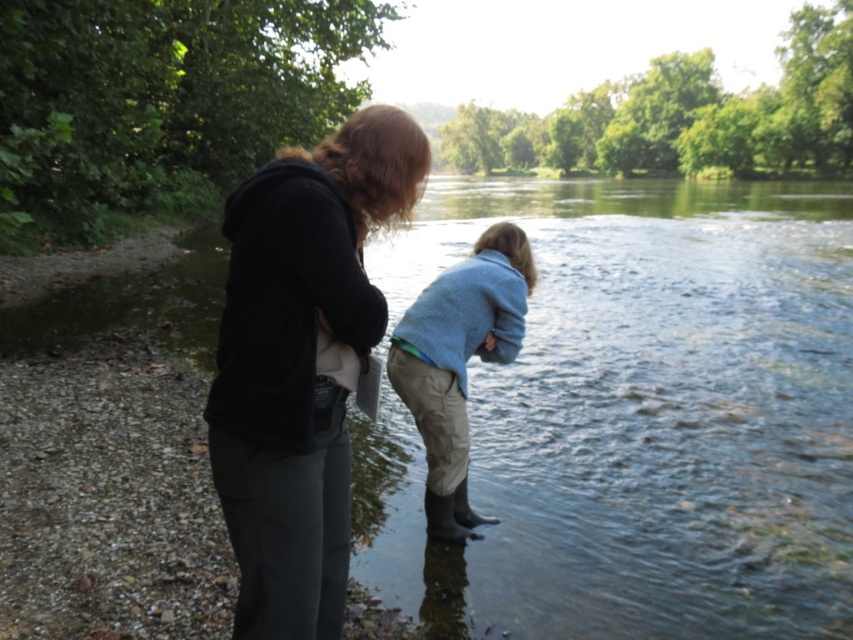
You are a delivery drone with a wingspan of 1.5 meters. You need to fly between the matte black hoodie at center and the viewer. Can you fit through that space?

The distance between the matte black hoodie at center and the viewer is 1.80 meters, so the drone with a wingspan of 1.5 meters can fit through the space since it is narrower than the available distance.

You are a photographer positioned behind the two people in the image. You want to take a photo that focuses on the matte black hoodie at center while keeping the light blue sweater at center in the background. Is this possible given their positions?

Yes, because the matte black hoodie at center is closer to the viewer than the light blue sweater at center, so focusing on the former will naturally place the latter in the background.

You are a photographer trying to capture a photo of the matte black hoodie at center and the light blue sweater at center. Since you want to ensure both are in focus, you need to know their heights. Which one is taller?

The matte black hoodie at center is taller than the light blue sweater at center.